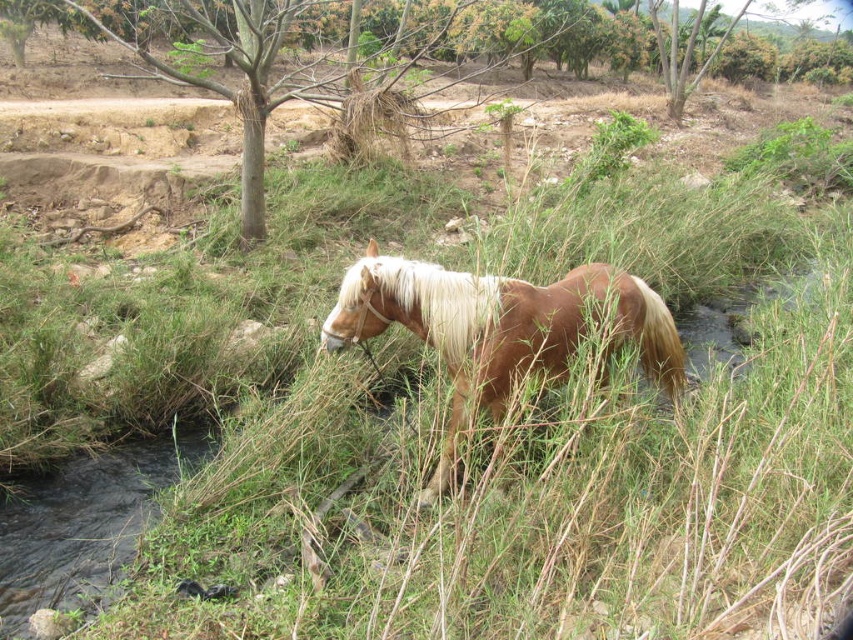
Looking at this image, you are a photographer trying to capture the brown glossy horse at center and its white silky mane at center in a single frame. Since the horse is taller than its mane, will you need to adjust your camera angle to ensure the entire horse and mane are visible?

The brown glossy horse at center is taller than the white silky mane at center, so you can capture both in a single frame without needing to adjust the camera angle significantly. Ensure the camera is positioned to include the full height of the horse, and the mane will naturally be within the frame.

You are a photographer positioned at the origin point of the coordinate system. You want to capture the brown glossy horse at center in your shot. What are the coordinates where the horse is located?

The brown glossy horse at center is located at coordinates point (496, 326).